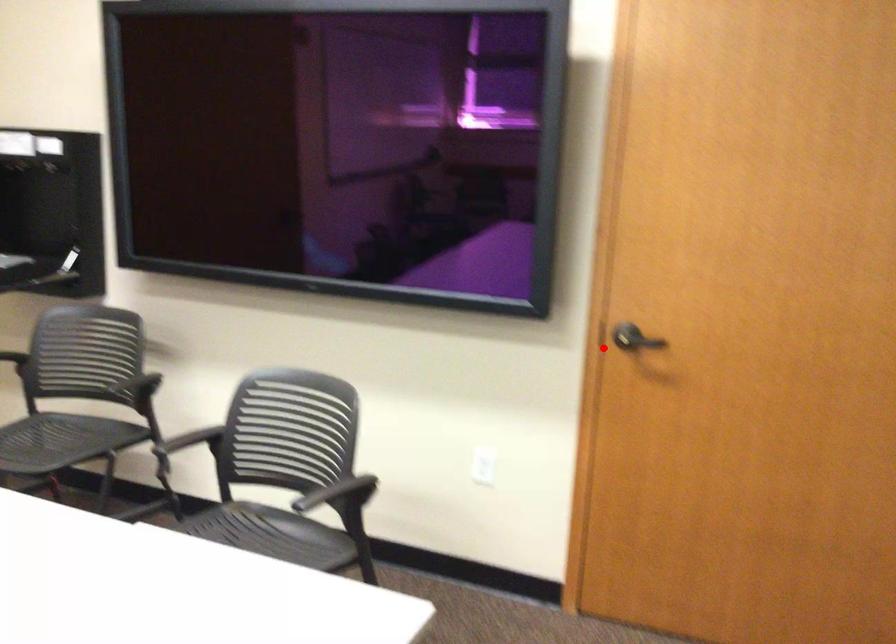
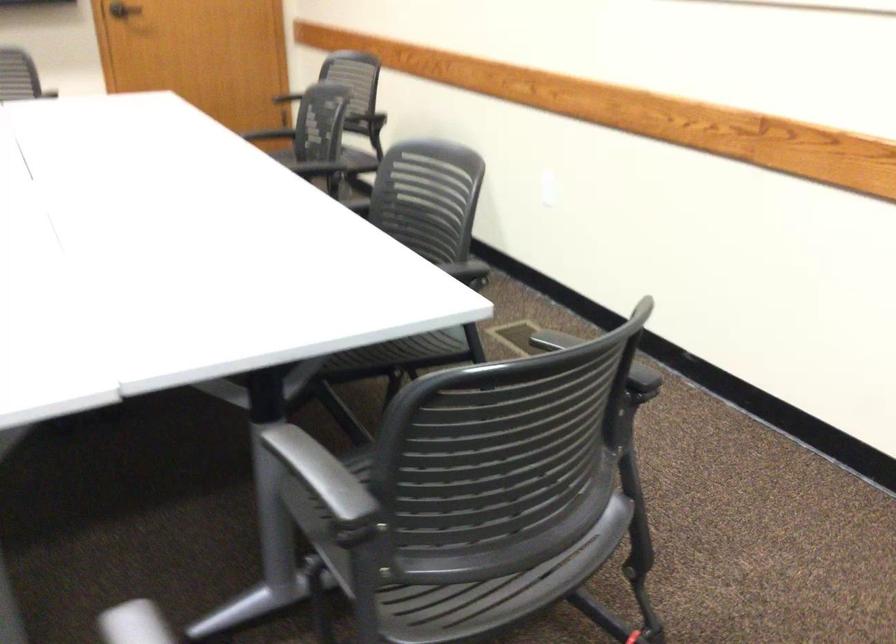
Question: A red point is marked in image1. In image2, is the corresponding 3D point closer to the camera or farther? Reply with the corresponding letter.

Choices:
 (A) The corresponding 3D point is closer.
 (B) The corresponding 3D point is farther.

Answer: (B)